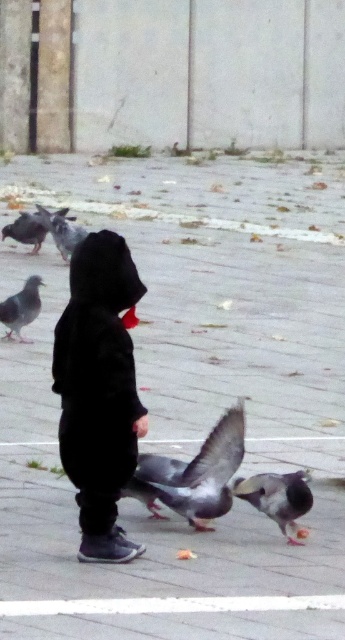
You are standing at the point marked by coordinates point (99, 392). Looking around, you see a child wearing a black matte hoodie at center. Which direction should you move to get closer to the child?

The point (99, 392) is already on the black matte hoodie at center, so you are already at the child.

You are a photographer trying to capture both the gray matte pigeon at center and the gray matte pigeon at upper left in a single shot. Which pigeon should you focus on first to ensure both are in frame?

You should focus on the gray matte pigeon at upper left first because it is larger and will help frame the shot to include the smaller gray matte pigeon at center.